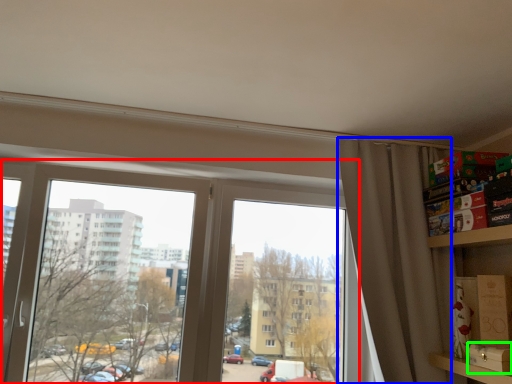
Question: Which object is positioned farthest from window (highlighted by a red box)? Select from curtain (highlighted by a blue box) and cardboard box (highlighted by a green box).

Choices:
 (A) curtain
 (B) cardboard box

Answer: (B)